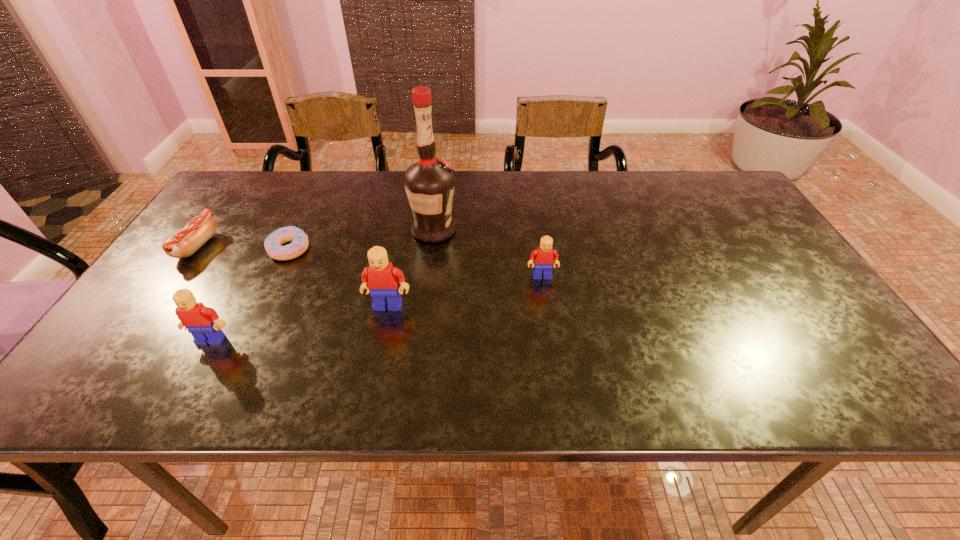
Identify the location of free space at the right edge of the desktop. This screenshot has height=540, width=960. (775, 278).

This screenshot has height=540, width=960. I want to click on free space at the far left corner of the desktop, so click(228, 184).

Identify the location of free space between the liquor and the second nearest Lego. Image resolution: width=960 pixels, height=540 pixels. (411, 268).

Identify the location of vacant space in between the doughnut and the third tallest object. (250, 295).

Where is `vacant space that's between the doughnut and the liquor`? This screenshot has height=540, width=960. vacant space that's between the doughnut and the liquor is located at coordinates (361, 240).

Where is `vacant area that lies between the second nearest Lego and the third nearest object`? vacant area that lies between the second nearest Lego and the third nearest object is located at coordinates (465, 291).

Image resolution: width=960 pixels, height=540 pixels. Find the location of `free space between the tallest object and the doughnut`. free space between the tallest object and the doughnut is located at coordinates (361, 240).

The height and width of the screenshot is (540, 960). Find the location of `unoccupied area between the sausage and the second shortest Lego`. unoccupied area between the sausage and the second shortest Lego is located at coordinates (204, 293).

Find the location of `vacant space that is in between the second Lego from right to left and the fourth tallest object`. vacant space that is in between the second Lego from right to left and the fourth tallest object is located at coordinates (465, 291).

Identify which object is the fourth closest to the sausage. Please provide its 2D coordinates. Your answer should be formatted as a tuple, i.e. [(x, y)], where the tuple contains the x and y coordinates of a point satisfying the conditions above.

[(429, 183)]